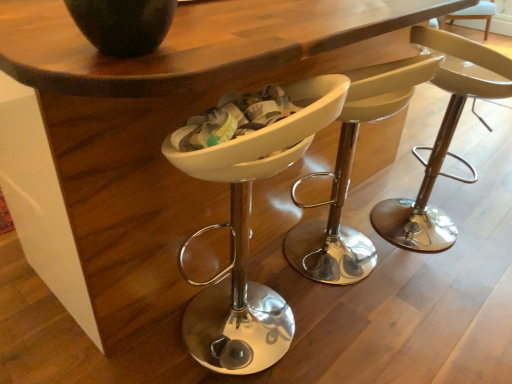
Question: In which direction should I rotate to look at white plastic chair at center, which appears as the first chair when viewed from the left?

Choices:
 (A) right
 (B) left

Answer: (B)

Question: Does white plastic chair at center, the 2th chair when ordered from right to left, have a larger size compared to white plastic chair at center, which ranks as the 3th chair in right-to-left order?

Choices:
 (A) yes
 (B) no

Answer: (A)

Question: From a real-world perspective, does white plastic chair at center, which is counted as the 2th chair, starting from the left, sit lower than white plastic chair at center, which appears as the first chair when viewed from the left?

Choices:
 (A) yes
 (B) no

Answer: (B)

Question: Is white plastic chair at center, which is counted as the 2th chair, starting from the left, completely or partially outside of white plastic chair at center, which ranks as the 3th chair in right-to-left order?

Choices:
 (A) no
 (B) yes

Answer: (B)

Question: Is white plastic chair at center, which is counted as the 2th chair, starting from the left, thinner than white plastic chair at center, which appears as the first chair when viewed from the left?

Choices:
 (A) no
 (B) yes

Answer: (A)

Question: Does white plastic chair at center, the 2th chair when ordered from right to left, appear on the right side of white plastic chair at center, which ranks as the 3th chair in right-to-left order?

Choices:
 (A) no
 (B) yes

Answer: (B)

Question: Is white plastic chair at center, which is counted as the 2th chair, starting from the left, aimed at white plastic chair at center, which appears as the first chair when viewed from the left?

Choices:
 (A) yes
 (B) no

Answer: (B)

Question: Can you confirm if matte beige stool at center, which ranks as the first chair in right-to-left order, is wider than matte black vase at upper left?

Choices:
 (A) yes
 (B) no

Answer: (A)

Question: Could you tell me if matte beige stool at center, which ranks as the first chair in right-to-left order, is facing matte black vase at upper left?

Choices:
 (A) no
 (B) yes

Answer: (A)

Question: Is matte beige stool at center, the third chair when ordered from left to right, looking in the opposite direction of matte black vase at upper left?

Choices:
 (A) no
 (B) yes

Answer: (B)

Question: Considering the relative sizes of matte beige stool at center, which ranks as the first chair in right-to-left order, and matte black vase at upper left in the image provided, is matte beige stool at center, which ranks as the first chair in right-to-left order, thinner than matte black vase at upper left?

Choices:
 (A) yes
 (B) no

Answer: (B)

Question: From a real-world perspective, is matte beige stool at center, the third chair when ordered from left to right, physically below matte black vase at upper left?

Choices:
 (A) no
 (B) yes

Answer: (B)

Question: Does matte beige stool at center, the third chair when ordered from left to right, have a lesser height compared to matte black vase at upper left?

Choices:
 (A) yes
 (B) no

Answer: (B)

Question: Is matte white bar stool at center at the back of white plastic chair at center, which is counted as the 2th chair, starting from the left?

Choices:
 (A) yes
 (B) no

Answer: (B)